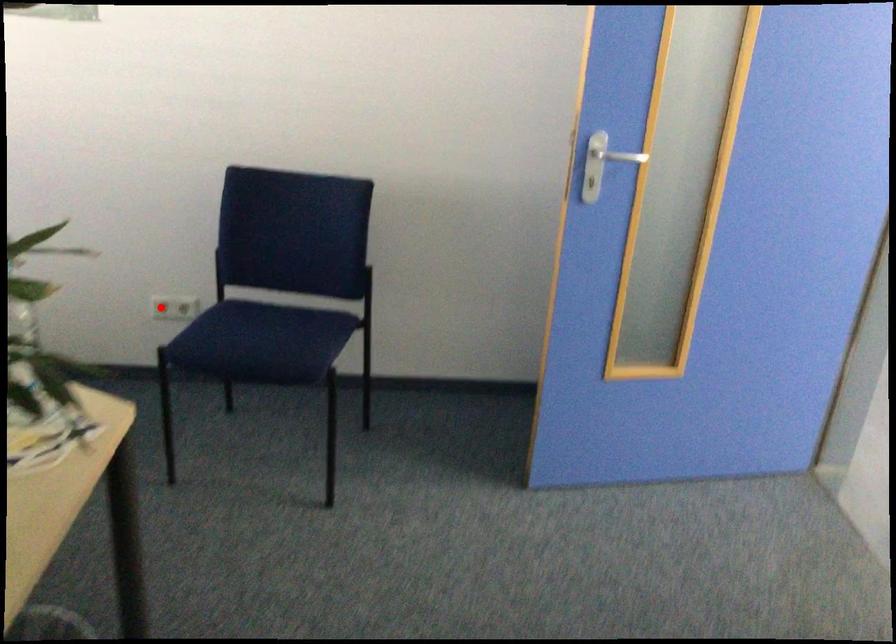
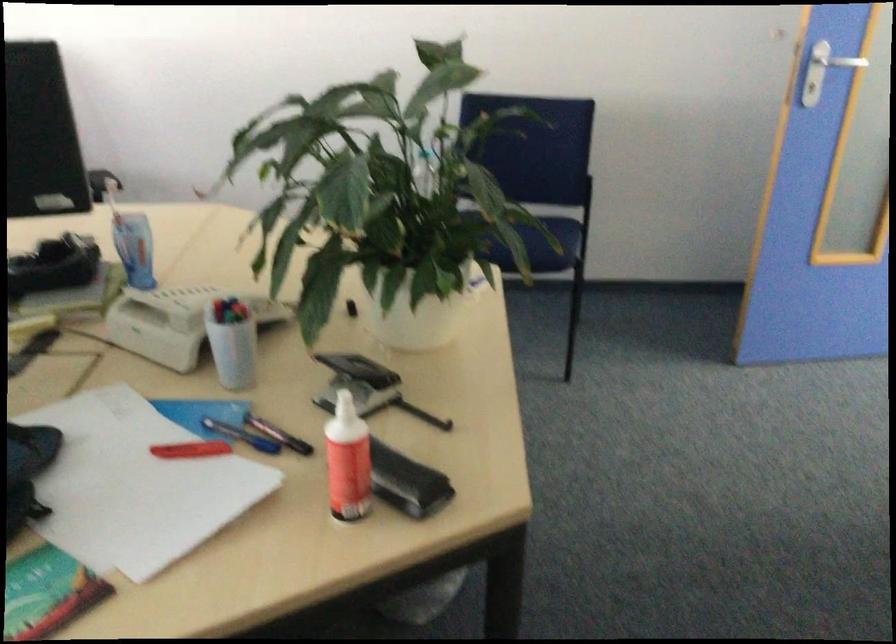
Question: I am providing you with two images of the same scene from different viewpoints. A red point is marked on the first image. Is the red point's position out of view in image 2?

Choices:
 (A) Yes
 (B) No

Answer: (A)